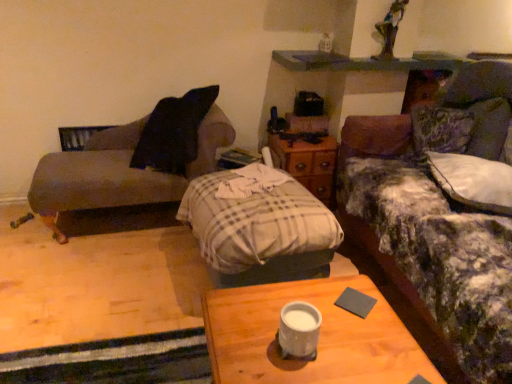
Locate an element on the screen. The width and height of the screenshot is (512, 384). free space that is to the left of plaid fabric pillow at center is located at coordinates (122, 288).